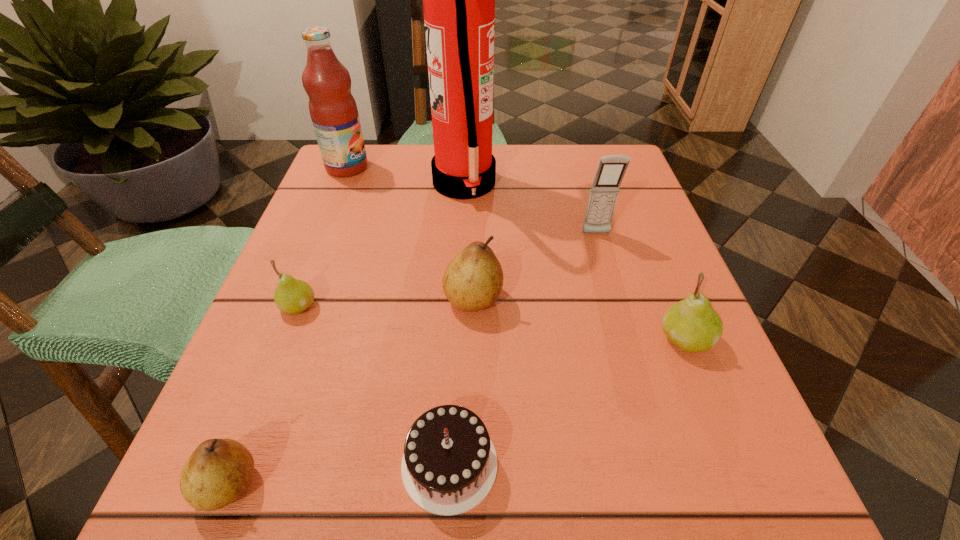
Where is `free spot at the far edge of the desktop`? free spot at the far edge of the desktop is located at coordinates (403, 175).

I want to click on vacant space at the left edge of the desktop, so click(335, 290).

This screenshot has width=960, height=540. I want to click on vacant space at the right edge of the desktop, so click(x=631, y=228).

I want to click on vacant space at the far left corner of the desktop, so click(x=372, y=180).

I want to click on free location at the near left corner of the desktop, so click(x=309, y=516).

In the image, there is a desktop. Identify the location of vacant space at the far right corner. (627, 200).

Locate an element on the screen. free space at the near right corner of the desktop is located at coordinates (712, 458).

Find the location of a particular element. vacant area that lies between the fire extinguisher and the smaller green pear is located at coordinates (381, 245).

I want to click on free space that is in between the chocolate cake and the bigger brown pear, so click(462, 381).

I want to click on empty space that is in between the third farthest object and the nearer brown pear, so click(413, 359).